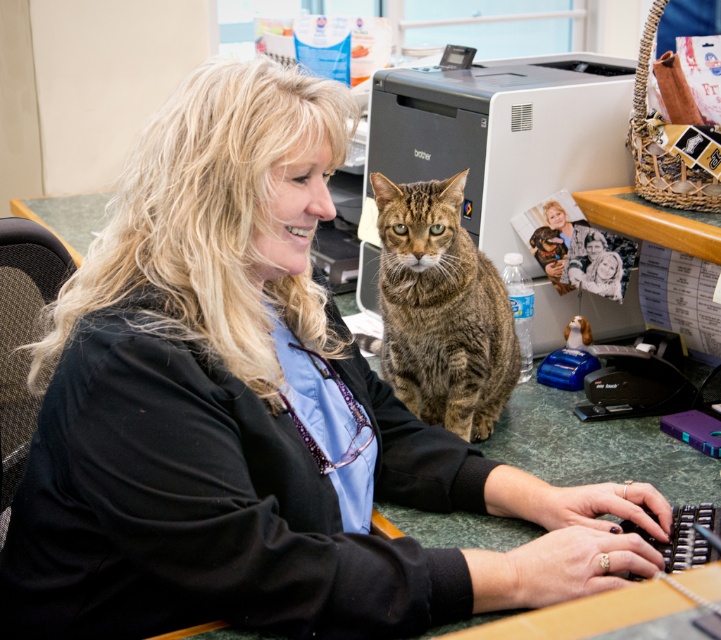
Question: Which point is farther to the camera?

Choices:
 (A) tabby fur cat at center
 (B) matte black printer at center

Answer: (B)

Question: Can you confirm if matte black printer at center is smaller than tabby fur cat at center?

Choices:
 (A) yes
 (B) no

Answer: (B)

Question: Is matte black printer at center above tabby fur cat at center?

Choices:
 (A) yes
 (B) no

Answer: (A)

Question: Can you confirm if matte black printer at center is positioned below tabby fur cat at center?

Choices:
 (A) no
 (B) yes

Answer: (A)